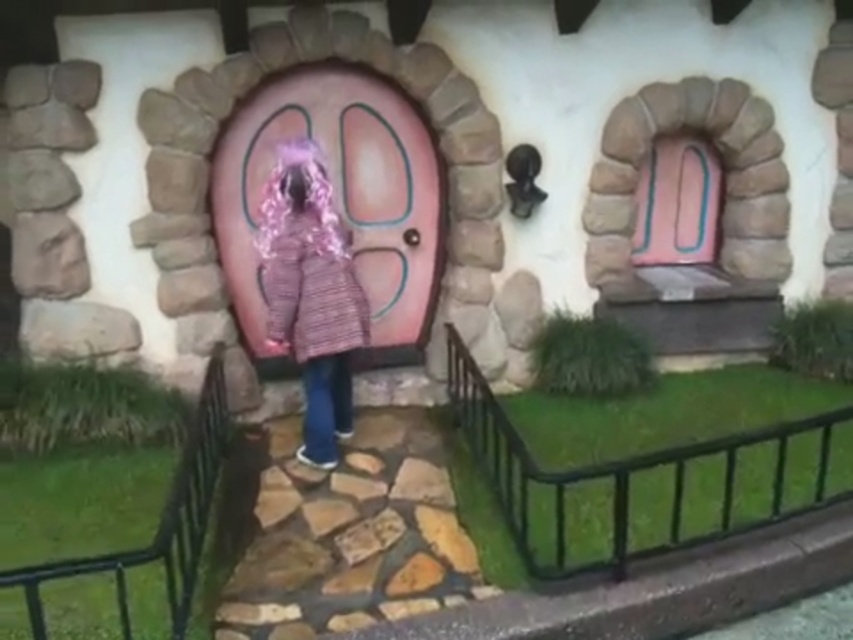
Is pink knitted coat at center bigger than pink glossy door at upper center?

Correct, pink knitted coat at center is larger in size than pink glossy door at upper center.

Where is `pink knitted coat at center`? This screenshot has height=640, width=853. pink knitted coat at center is located at coordinates tap(311, 292).

Where is `pink knitted coat at center`? The height and width of the screenshot is (640, 853). pink knitted coat at center is located at coordinates (311, 292).